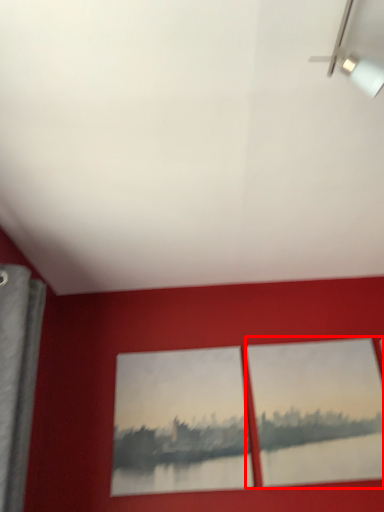
Question: From the image's perspective, what is the correct spatial relationship of picture frame (annotated by the red box) in relation to picture frame?

Choices:
 (A) below
 (B) above

Answer: (B)